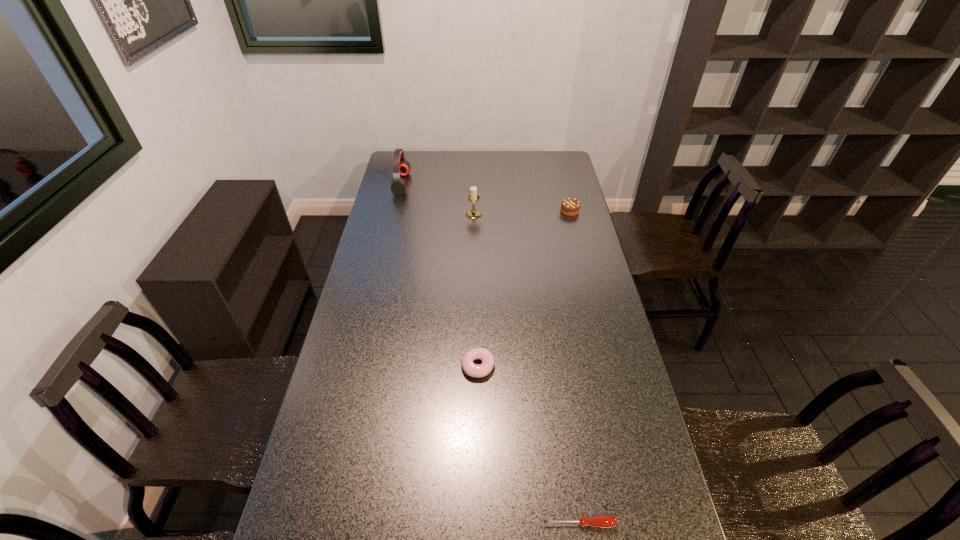
You are a GUI agent. You are given a task and a screenshot of the screen. Output one action in this format:
    pyautogui.click(x=<x>, y=<y>)
    Task: Click on the vacant space at the left edge
    The image size is (960, 540).
    Given the screenshot: What is the action you would take?
    pyautogui.click(x=391, y=209)

The width and height of the screenshot is (960, 540). In order to click on vacant space at the right edge of the desktop in this screenshot , I will do `click(649, 525)`.

Where is `vacant region at the far left corner of the desktop`? The height and width of the screenshot is (540, 960). vacant region at the far left corner of the desktop is located at coordinates (422, 155).

Where is `vacant space at the far right corner of the desktop`? This screenshot has height=540, width=960. vacant space at the far right corner of the desktop is located at coordinates (556, 157).

The width and height of the screenshot is (960, 540). Identify the location of vacant region between the chocolate cake and the second shortest object. (523, 289).

The width and height of the screenshot is (960, 540). Find the location of `vacant space in between the earphone and the candle holder`. vacant space in between the earphone and the candle holder is located at coordinates (438, 199).

Where is `free space between the third shortest object and the second shortest object`? The width and height of the screenshot is (960, 540). free space between the third shortest object and the second shortest object is located at coordinates pos(523,289).

The height and width of the screenshot is (540, 960). Identify the location of free point between the screwdriver and the fourth shortest object. (527, 369).

At what (x,y) coordinates should I click in order to perform the action: click on unoccupied position between the second nearest object and the farthest object. Please return your answer as a coordinate pair (x, y). This screenshot has height=540, width=960. Looking at the image, I should click on (440, 275).

I want to click on the fourth closest object relative to the shortest object, so click(x=401, y=167).